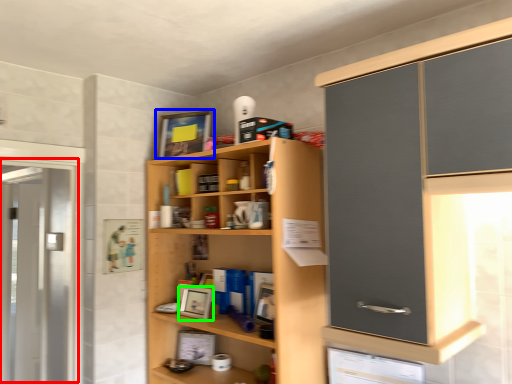
Question: Based on their relative distances, which object is nearer to screen door (highlighted by a red box)? Choose from picture frame (highlighted by a blue box) and picture frame (highlighted by a green box).

Choices:
 (A) picture frame
 (B) picture frame

Answer: (A)